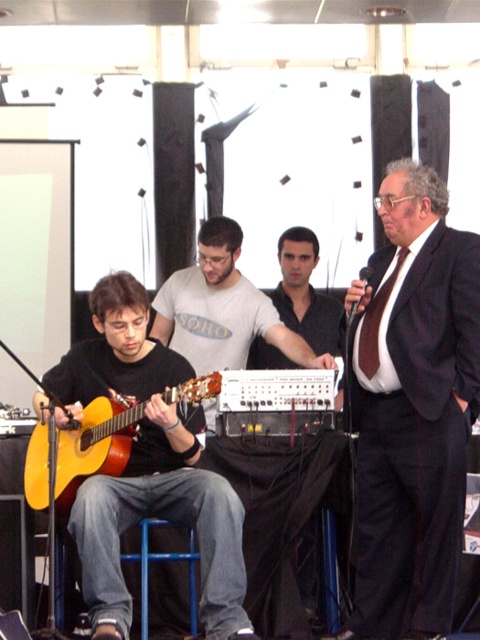
Question: In this image, where is matte brown guitar at left located relative to acoustic wood guitar at left?

Choices:
 (A) above
 (B) below

Answer: (B)

Question: Observing the image, what is the correct spatial positioning of dark brown suit at center in reference to matte gray shirt at center?

Choices:
 (A) right
 (B) left

Answer: (A)

Question: Which of the following is the closest to the observer?

Choices:
 (A) (71, 454)
 (B) (97, 387)

Answer: (A)

Question: Which point is farther to the camera?

Choices:
 (A) acoustic wood guitar at left
 (B) dark brown suit at center
 (C) matte gray shirt at center
 (D) matte brown guitar at left

Answer: (C)

Question: Can you confirm if matte brown guitar at left is positioned to the left of matte gray shirt at center?

Choices:
 (A) no
 (B) yes

Answer: (B)

Question: Which point is closer to the camera taking this photo?

Choices:
 (A) (67, 481)
 (B) (276, 344)
 (C) (212, 627)
 (D) (374, 596)

Answer: (C)